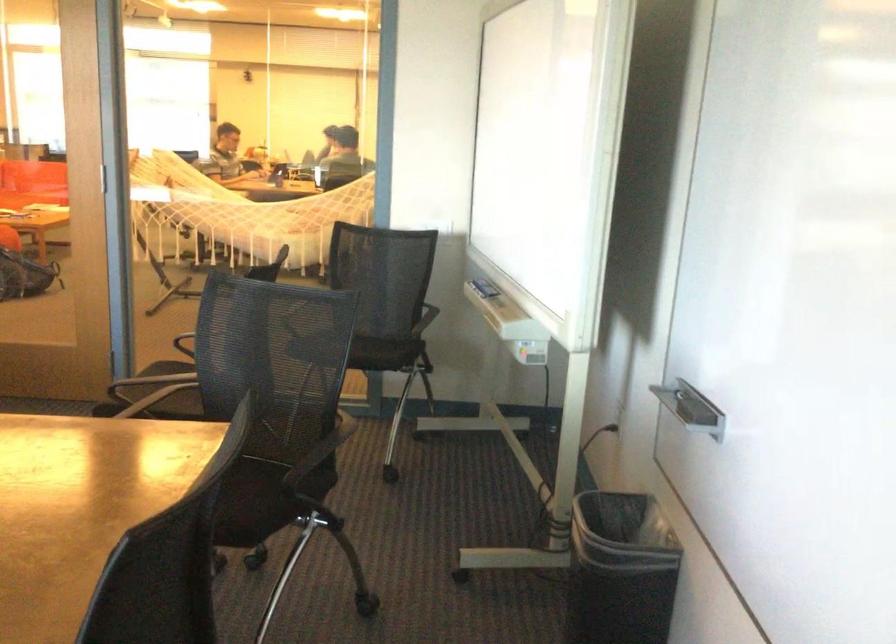
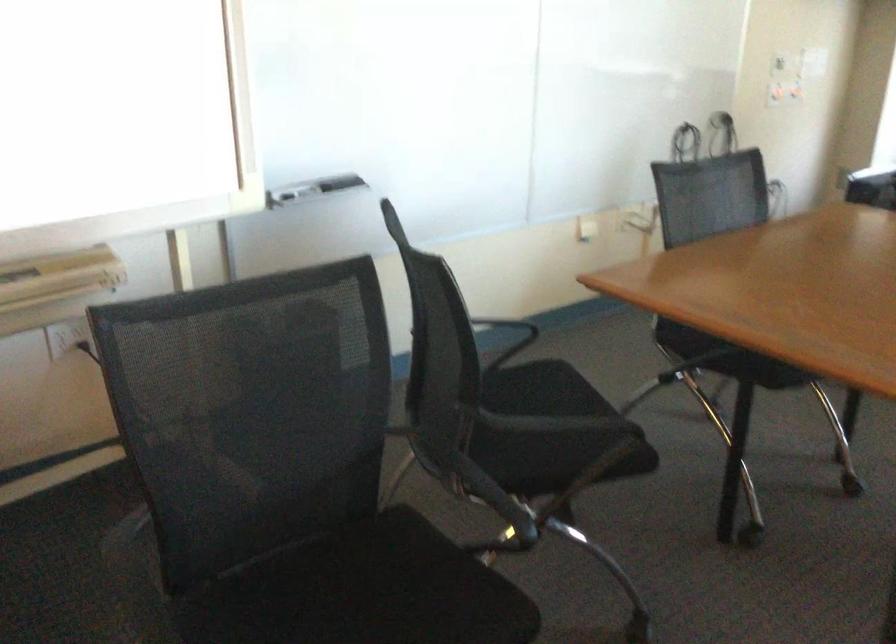
Where in the second image is the point corresponding to (x=186, y=399) from the first image?

(363, 592)